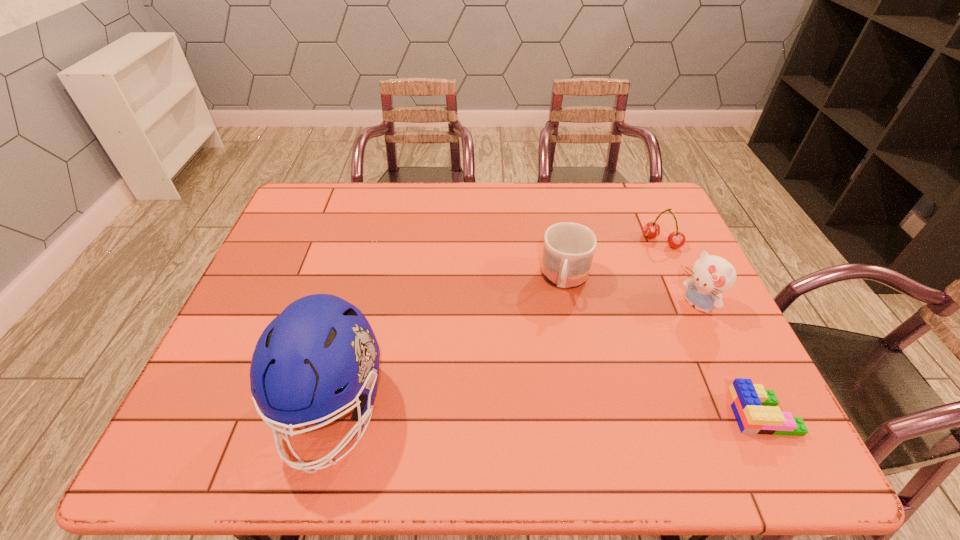
Identify the location of free space that is in between the fourth shortest object and the Lego. (730, 360).

I want to click on vacant area that lies between the second tallest object and the cherry, so click(679, 274).

Find the location of a particular element. Image resolution: width=960 pixels, height=540 pixels. empty space that is in between the leftmost object and the Lego is located at coordinates (547, 411).

This screenshot has width=960, height=540. In order to click on vacant area that lies between the cherry and the Lego in this screenshot , I will do `click(712, 328)`.

Identify the location of free area in between the kitten and the mug. (631, 293).

The height and width of the screenshot is (540, 960). I want to click on unoccupied position between the kitten and the farthest object, so click(x=679, y=274).

At what (x,y) coordinates should I click in order to perform the action: click on free spot between the shortest object and the cherry. Please return your answer as a coordinate pair (x, y). Image resolution: width=960 pixels, height=540 pixels. Looking at the image, I should click on (712, 328).

Locate an element on the screen. The image size is (960, 540). free space between the second tallest object and the football helmet is located at coordinates (515, 357).

Select which object appears as the third closest to the fourth shortest object. Please provide its 2D coordinates. Your answer should be formatted as a tuple, i.e. [(x, y)], where the tuple contains the x and y coordinates of a point satisfying the conditions above.

[(568, 249)]

Identify which object is the second nearest to the shortest object. Please provide its 2D coordinates. Your answer should be formatted as a tuple, i.e. [(x, y)], where the tuple contains the x and y coordinates of a point satisfying the conditions above.

[(568, 249)]